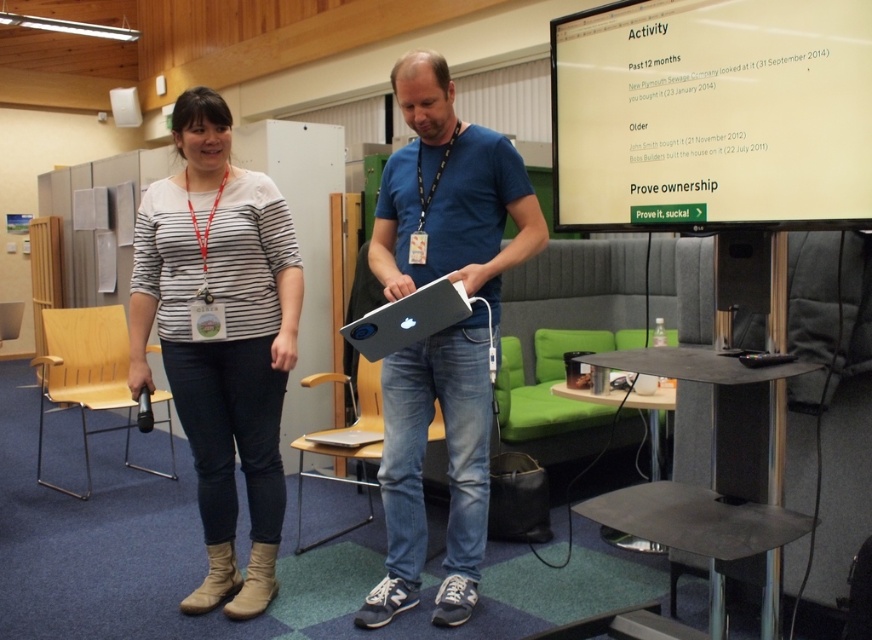
Who is taller, matte striped shirt at center or matte white laptop at center?

matte white laptop at center

Between matte striped shirt at center and matte white laptop at center, which one is positioned higher?

matte white laptop at center is higher up.

Who is more forward, (247,348) or (468,212)?

Point (468,212) is in front.

Where is `matte striped shirt at center`? This screenshot has height=640, width=872. matte striped shirt at center is located at coordinates (220, 337).

Does matte black laptop at center have a larger size compared to matte white laptop at center?

No.

Is point (522, 214) in front of point (491, 268)?

No, (522, 214) is further to viewer.

Where is `matte black laptop at center`? The image size is (872, 640). matte black laptop at center is located at coordinates (443, 330).

Is matte striped shirt at center below matte black laptop at center?

Indeed, matte striped shirt at center is positioned under matte black laptop at center.

Is the position of matte striped shirt at center less distant than that of matte black laptop at center?

No, it is not.

Is point (271, 538) closer to viewer compared to point (414, 275)?

No, (271, 538) is further to viewer.

Find the location of a particular element. The image size is (872, 640). matte striped shirt at center is located at coordinates (220, 337).